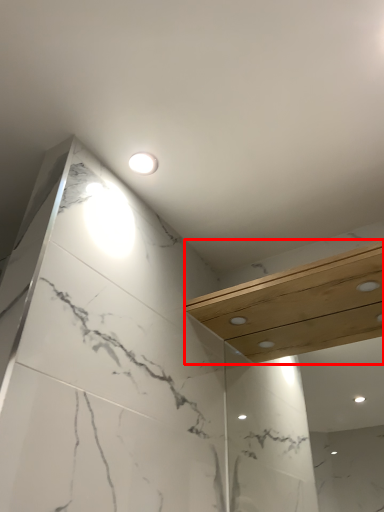
Question: From the image's perspective, what is the correct spatial relationship of balustrade (annotated by the red box) in relation to light fixture?

Choices:
 (A) below
 (B) above

Answer: (A)